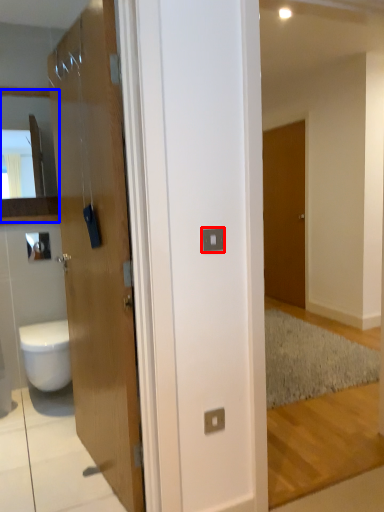
Question: Which of the following is the farthest to the observer, electric outlet (highlighted by a red box) or cabinet (highlighted by a blue box)?

Choices:
 (A) electric outlet
 (B) cabinet

Answer: (B)